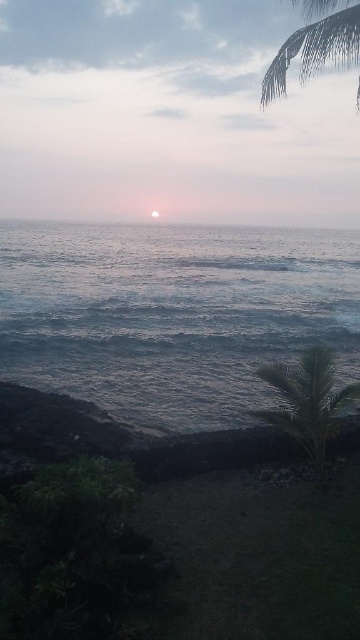
Does grayish-blue water at center have a larger size compared to green leafy palm at upper right?

No.

Is grayish-blue water at center above green leafy palm at upper right?

Incorrect, grayish-blue water at center is not positioned above green leafy palm at upper right.

Is point (165, 307) positioned in front of point (282, 52)?

No.

Where is `grayish-blue water at center`? The width and height of the screenshot is (360, 640). grayish-blue water at center is located at coordinates (173, 314).

Between green leafy palm tree at lower right and green leafy palm at upper right, which one appears on the left side from the viewer's perspective?

From the viewer's perspective, green leafy palm tree at lower right appears more on the left side.

Between point (254, 413) and point (324, 44), which one is positioned behind?

Point (254, 413)

This screenshot has width=360, height=640. What are the coordinates of `green leafy palm tree at lower right` in the screenshot? It's located at (308, 401).

Who is lower down, grayish-blue water at center or green leafy palm tree at lower right?

Positioned lower is green leafy palm tree at lower right.

Can you confirm if grayish-blue water at center is thinner than green leafy palm tree at lower right?

No.

The height and width of the screenshot is (640, 360). What do you see at coordinates (173, 314) in the screenshot?
I see `grayish-blue water at center` at bounding box center [173, 314].

The height and width of the screenshot is (640, 360). Identify the location of grayish-blue water at center. pyautogui.click(x=173, y=314).